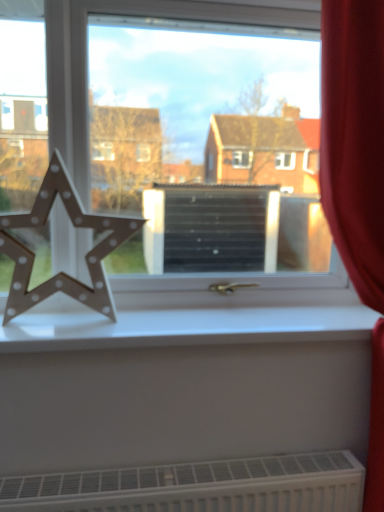
Question: From the image's perspective, does wooden star at left appear higher than red velvet curtain at right?

Choices:
 (A) no
 (B) yes

Answer: (B)

Question: Can you confirm if wooden star at left is taller than red velvet curtain at right?

Choices:
 (A) yes
 (B) no

Answer: (B)

Question: Does wooden star at left have a greater width compared to red velvet curtain at right?

Choices:
 (A) yes
 (B) no

Answer: (B)

Question: From a real-world perspective, is wooden star at left on red velvet curtain at right?

Choices:
 (A) no
 (B) yes

Answer: (B)

Question: Would you say wooden star at left contains red velvet curtain at right?

Choices:
 (A) yes
 (B) no

Answer: (B)

Question: Is wooden star at left oriented towards red velvet curtain at right?

Choices:
 (A) yes
 (B) no

Answer: (B)

Question: Considering the relative sizes of white matte window sill at center and wooden star at left in the image provided, is white matte window sill at center shorter than wooden star at left?

Choices:
 (A) yes
 (B) no

Answer: (A)

Question: Is white matte window sill at center with wooden star at left?

Choices:
 (A) yes
 (B) no

Answer: (B)

Question: Is white matte window sill at center thinner than wooden star at left?

Choices:
 (A) no
 (B) yes

Answer: (A)

Question: Is white matte window sill at center bigger than wooden star at left?

Choices:
 (A) yes
 (B) no

Answer: (A)

Question: Would you say white matte window sill at center is outside wooden star at left?

Choices:
 (A) no
 (B) yes

Answer: (B)

Question: Considering the relative sizes of white matte window sill at center and wooden star at left in the image provided, is white matte window sill at center wider than wooden star at left?

Choices:
 (A) yes
 (B) no

Answer: (A)

Question: Is red velvet curtain at right completely or partially outside of wooden star at left?

Choices:
 (A) no
 (B) yes

Answer: (B)